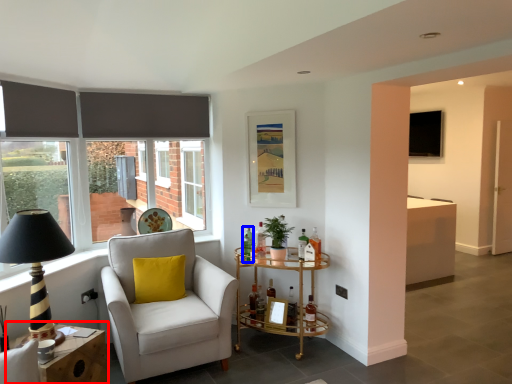
Question: Which of the following is the farthest to the observer, table (highlighted by a red box) or bottle (highlighted by a blue box)?

Choices:
 (A) table
 (B) bottle

Answer: (B)